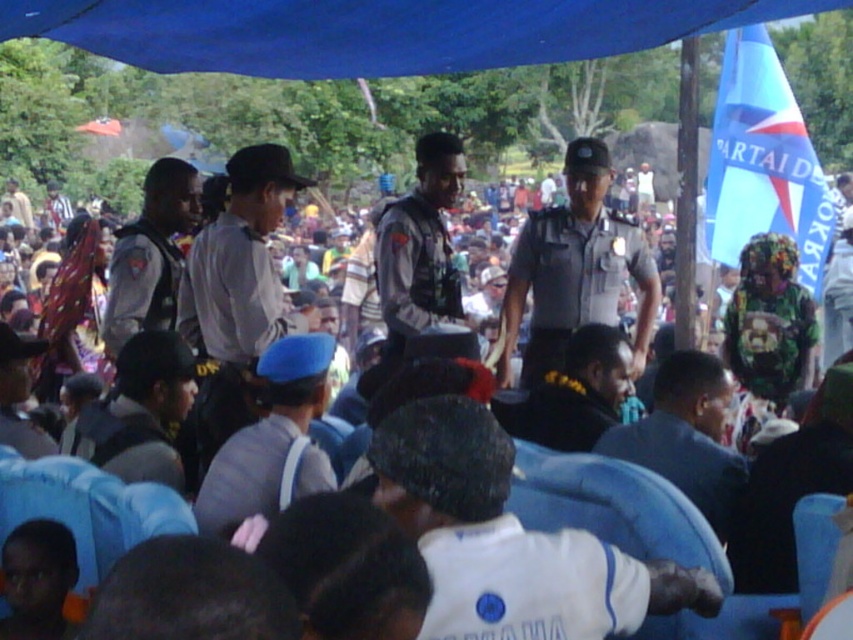
Question: Does white shirt at center have a smaller size compared to gray uniform at center?

Choices:
 (A) no
 (B) yes

Answer: (A)

Question: In this image, where is dark blue fabric at center located relative to black uniform at center?

Choices:
 (A) left
 (B) right

Answer: (B)

Question: Which point is farther to the camera?

Choices:
 (A) black fabric headband at center
 (B) blue fabric hat at center
 (C) light brown uniform at center

Answer: (C)

Question: Which is nearer to the white fabric shirt at center?

Choices:
 (A) gray uniform at center
 (B) blue fabric hat at center
 (C) black uniform at center
 (D) dark blue fabric at center

Answer: (B)

Question: Is gray uniform at center further to the viewer compared to light brown uniform at center?

Choices:
 (A) no
 (B) yes

Answer: (B)

Question: Among these points, which one is farthest from the camera?

Choices:
 (A) (666, 588)
 (B) (251, 484)

Answer: (B)